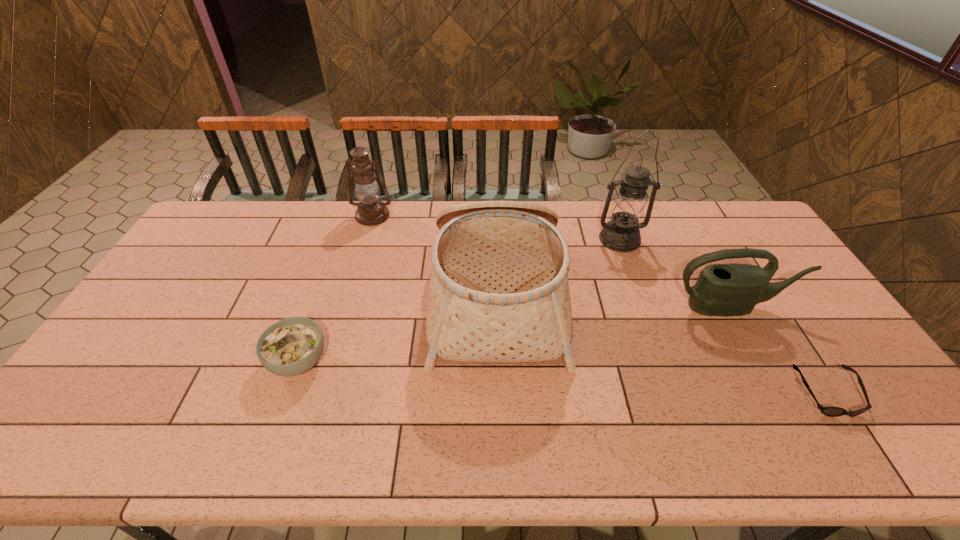
Locate an element on the screen. The height and width of the screenshot is (540, 960). free space at the left edge is located at coordinates (181, 315).

Locate an element on the screen. vacant space at the right edge is located at coordinates (900, 415).

Identify the location of vacant area at the far left corner of the desktop. Image resolution: width=960 pixels, height=540 pixels. (250, 212).

Locate an element on the screen. This screenshot has height=540, width=960. free point between the shortest object and the watering can is located at coordinates (780, 350).

Identify the location of empty location between the third shortest object and the fourth object from right to left. click(x=614, y=301).

At what (x,y) coordinates should I click in order to perform the action: click on vacant region between the soup bowl and the shortest object. Please return your answer as a coordinate pair (x, y). Image resolution: width=960 pixels, height=540 pixels. Looking at the image, I should click on pyautogui.click(x=563, y=377).

Locate an element on the screen. The width and height of the screenshot is (960, 540). empty space that is in between the taller oil lamp and the watering can is located at coordinates (676, 273).

What are the coordinates of `vacant space in between the third shortest object and the tallest object` in the screenshot? It's located at (676, 273).

Locate an element on the screen. The image size is (960, 540). unoccupied position between the shortest object and the watering can is located at coordinates (780, 350).

Select which object appears as the closest to the second shortest object. Please provide its 2D coordinates. Your answer should be formatted as a tuple, i.e. [(x, y)], where the tuple contains the x and y coordinates of a point satisfying the conditions above.

[(499, 292)]